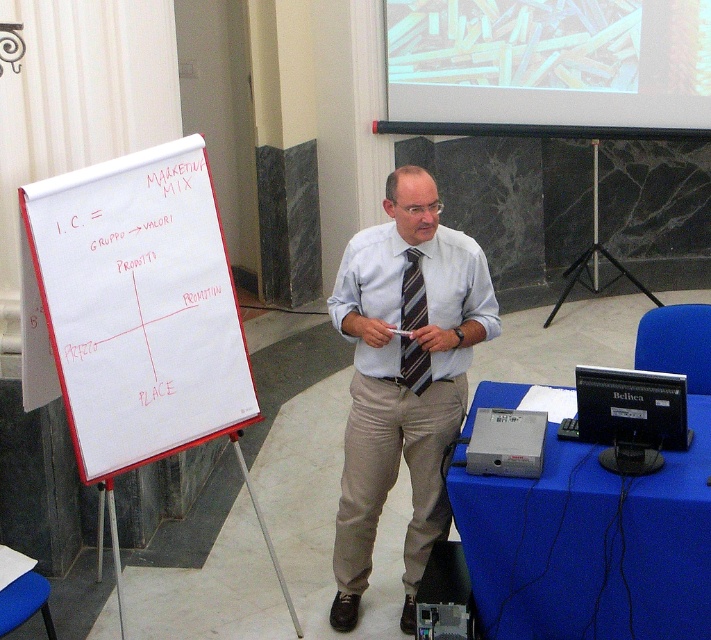
Question: Does light blue cotton dress shirt at center have a smaller size compared to black glossy monitor at center?

Choices:
 (A) yes
 (B) no

Answer: (B)

Question: Which of the following is the closest to the observer?

Choices:
 (A) black glossy monitor at center
 (B) translucent plastic screen at upper center
 (C) gray metallic projector at center
 (D) striped fabric tie at center

Answer: (A)

Question: Is black glossy monitor at center below striped fabric tie at center?

Choices:
 (A) no
 (B) yes

Answer: (B)

Question: Considering the real-world distances, which object is closest to the light blue shirt at center?

Choices:
 (A) light blue cotton dress shirt at center
 (B) translucent plastic screen at upper center

Answer: (A)

Question: Is gray metallic projector at center further to camera compared to striped fabric tie at center?

Choices:
 (A) yes
 (B) no

Answer: (B)

Question: Which is farther from the translucent plastic screen at upper center?

Choices:
 (A) striped fabric tie at center
 (B) whiteboard at left
 (C) black glossy monitor at center

Answer: (B)